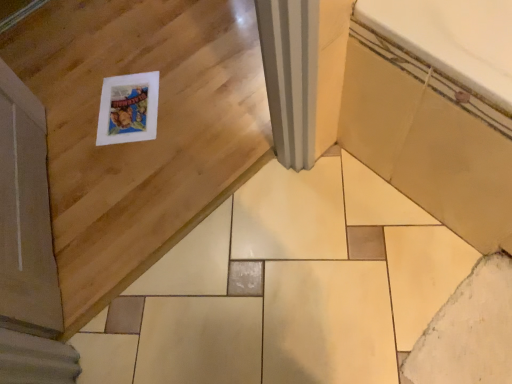
Image resolution: width=512 pixels, height=384 pixels. Identify the location of vacant area situated to the left side of white matte ceramic tile at lower right. (357, 326).